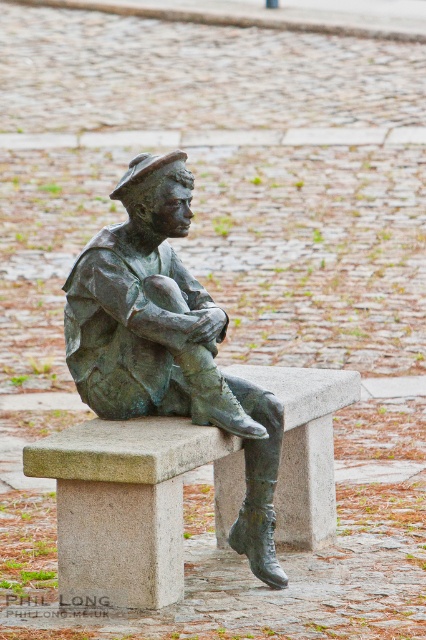
Which is above, granite bench at center or bronze statue at center?

bronze statue at center

Is granite bench at center closer to the viewer compared to bronze statue at center?

Yes, it is.

Where is `granite bench at center`? granite bench at center is located at coordinates (x=131, y=502).

Locate an element on the screen. This screenshot has height=640, width=426. granite bench at center is located at coordinates (131, 502).